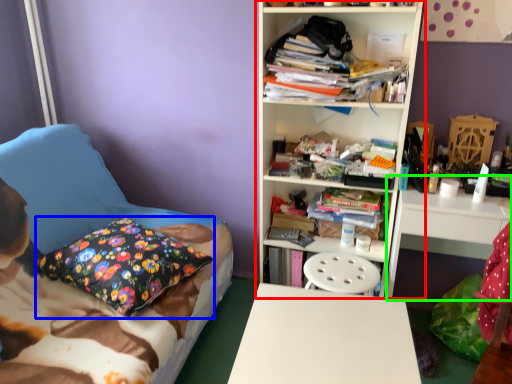
Question: Based on their relative distances, which object is farther from bookcase (highlighted by a red box)? Choose from pillow (highlighted by a blue box) and computer desk (highlighted by a green box).

Choices:
 (A) pillow
 (B) computer desk

Answer: (A)